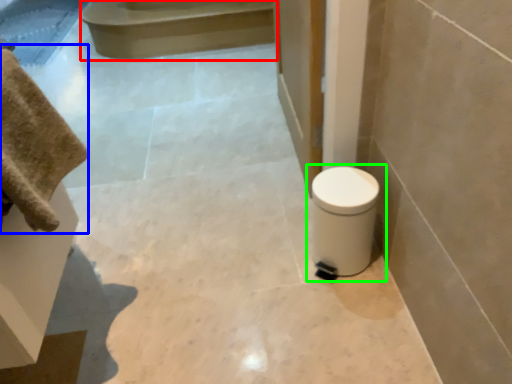
Question: Based on their relative distances, which object is nearer to stair (highlighted by a red box)? Choose from bath towel (highlighted by a blue box) and toilet (highlighted by a green box).

Choices:
 (A) bath towel
 (B) toilet

Answer: (B)